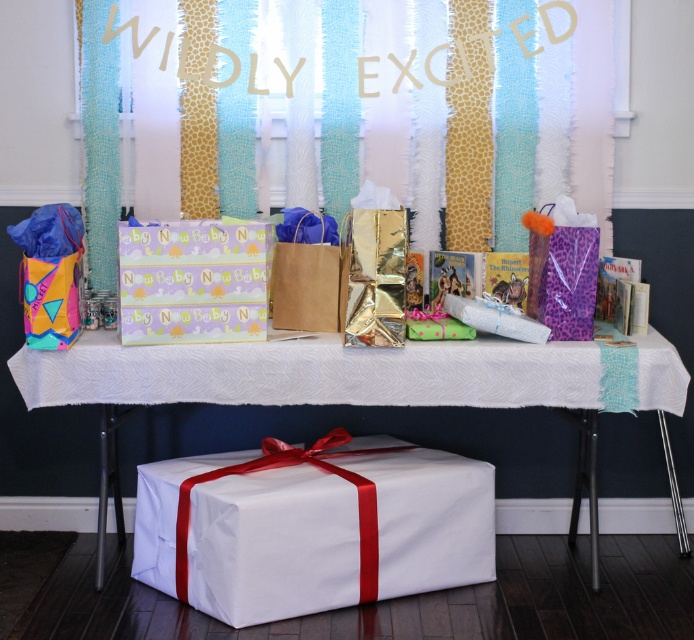
Between point (153, 211) and point (490, 348), which one is positioned in front?

Point (490, 348) is in front.

Is point (357, 70) farther from camera compared to point (242, 358)?

Yes, it is behind point (242, 358).

Does point (393, 112) lie in front of point (105, 474)?

No.

Locate an element on the screen. giraffe print fabric at upper center is located at coordinates click(499, 116).

The image size is (694, 640). Describe the element at coordinates (561, 269) in the screenshot. I see `purple leopard print gift bag at right` at that location.

Between point (559, 330) and point (310, 248), which one is positioned behind?

The point (310, 248) is more distant.

This screenshot has height=640, width=694. I want to click on purple leopard print gift bag at right, so click(561, 269).

Locate an element on the screen. giraffe print fabric at upper center is located at coordinates (x=499, y=116).

What do you see at coordinates (499, 116) in the screenshot? Image resolution: width=694 pixels, height=640 pixels. I see `giraffe print fabric at upper center` at bounding box center [499, 116].

Describe the element at coordinates (499, 116) in the screenshot. I see `giraffe print fabric at upper center` at that location.

Where is `giraffe print fabric at upper center`? Image resolution: width=694 pixels, height=640 pixels. giraffe print fabric at upper center is located at coordinates (499, 116).